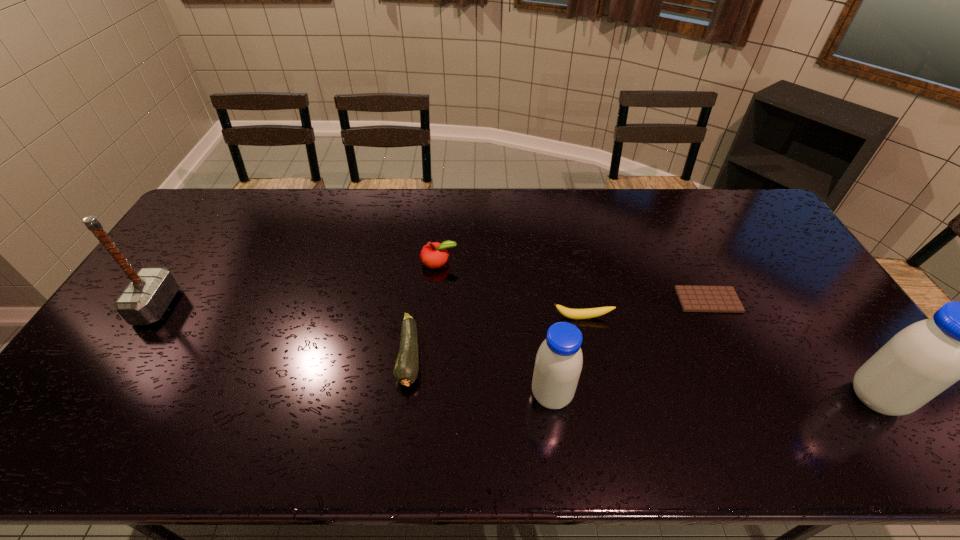
Locate an element on the screen. This screenshot has height=540, width=960. object that is at the near right corner is located at coordinates (921, 361).

Find the location of a particular element. free space at the far edge of the desktop is located at coordinates (272, 218).

This screenshot has width=960, height=540. In order to click on free space at the left edge of the desktop in this screenshot , I will do `click(184, 272)`.

In order to click on free spot between the banana and the shortest object in this screenshot , I will do `click(645, 309)`.

This screenshot has height=540, width=960. What are the coordinates of `unoccupied position between the shortest object and the leftmost object` in the screenshot? It's located at (433, 303).

Image resolution: width=960 pixels, height=540 pixels. Identify the location of vacant space that is in between the hammer and the taller soya milk. (516, 352).

Where is `blank region between the second object from right to left and the banana`? blank region between the second object from right to left and the banana is located at coordinates (645, 309).

Locate an element on the screen. This screenshot has width=960, height=540. free space between the sixth object from left to right and the apple is located at coordinates (573, 281).

Where is `free space between the shorter soya milk and the taller soya milk`? This screenshot has width=960, height=540. free space between the shorter soya milk and the taller soya milk is located at coordinates 713,396.

At what (x,y) coordinates should I click in order to perform the action: click on free space that is in between the banana and the zucchini. Please return your answer as a coordinate pair (x, y). The width and height of the screenshot is (960, 540). Looking at the image, I should click on (496, 338).